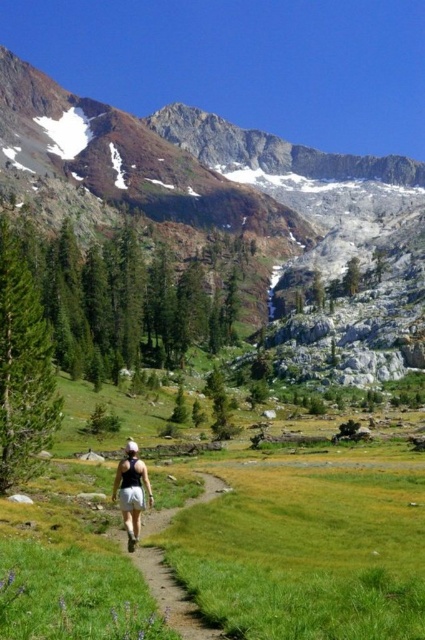
Question: Is green grassy field at center positioned before rocky gray mountain at upper center?

Choices:
 (A) yes
 (B) no

Answer: (A)

Question: Which point is closer to the camera?

Choices:
 (A) white cotton shorts at center
 (B) rocky gray mountain at upper center

Answer: (A)

Question: Does green grassy field at center have a greater width compared to rocky gray mountain at upper center?

Choices:
 (A) yes
 (B) no

Answer: (B)

Question: Which point appears closest to the camera in this image?

Choices:
 (A) (362, 250)
 (B) (322, 497)
 (C) (121, 460)

Answer: (B)

Question: Which point is farther to the camera?

Choices:
 (A) (274, 470)
 (B) (138, 531)

Answer: (A)

Question: Considering the relative positions of green grassy field at center and white cotton shorts at center in the image provided, where is green grassy field at center located with respect to white cotton shorts at center?

Choices:
 (A) below
 (B) above

Answer: (A)